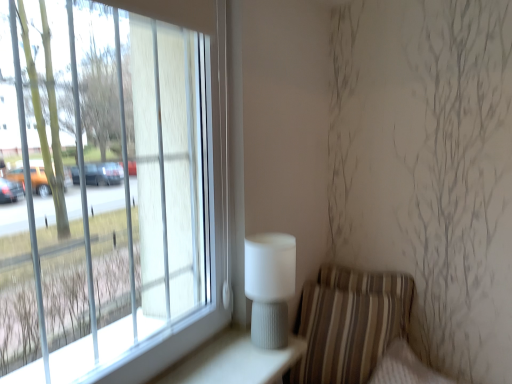
Question: From a real-world perspective, is striped fabric armchair at lower right physically located above or below white ribbed table lamp at right?

Choices:
 (A) below
 (B) above

Answer: (A)

Question: Is point (309, 367) positioned closer to the camera than point (272, 241)?

Choices:
 (A) closer
 (B) farther

Answer: (B)

Question: Choose the correct answer: Is striped fabric armchair at lower right inside white ribbed table lamp at right or outside it?

Choices:
 (A) outside
 (B) inside

Answer: (A)

Question: In the image, is white ribbed table lamp at right positioned in front of or behind striped fabric armchair at lower right?

Choices:
 (A) behind
 (B) front

Answer: (B)

Question: From a real-world perspective, is white ribbed table lamp at right above or below striped fabric armchair at lower right?

Choices:
 (A) below
 (B) above

Answer: (B)

Question: In terms of width, does white ribbed table lamp at right look wider or thinner when compared to striped fabric armchair at lower right?

Choices:
 (A) wide
 (B) thin

Answer: (B)

Question: From the image's perspective, relative to striped fabric armchair at lower right, is white ribbed table lamp at right above or below?

Choices:
 (A) below
 (B) above

Answer: (B)